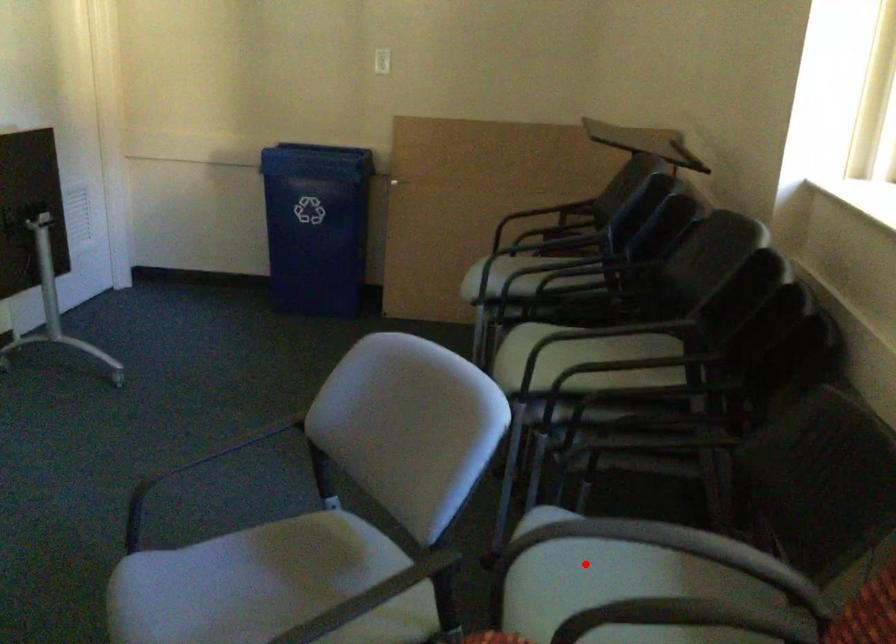
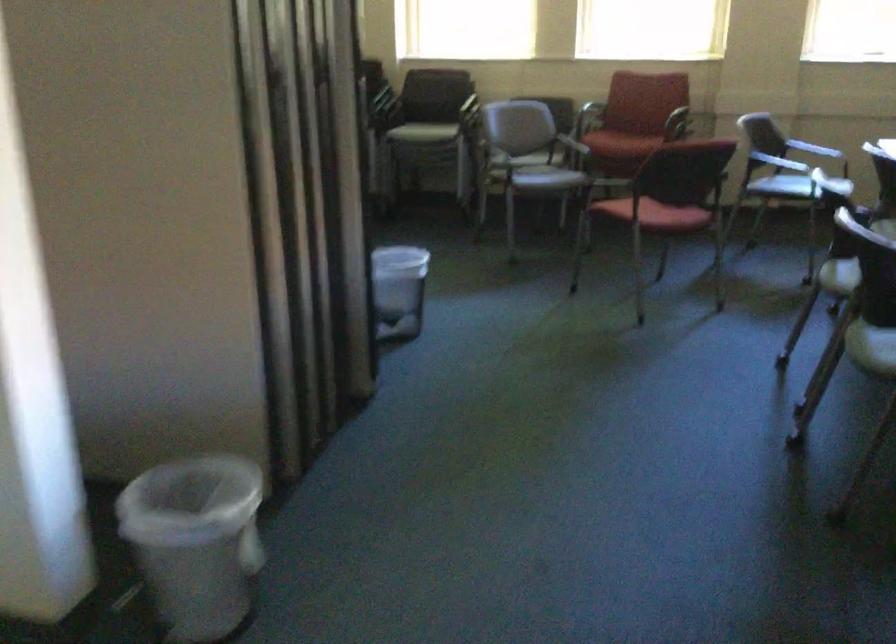
Question: I am providing you with two images of the same scene from different viewpoints. A red point is marked on the first image. At the location where the point appears in image 1, is it still visible in image 2?

Choices:
 (A) Yes
 (B) No

Answer: (B)